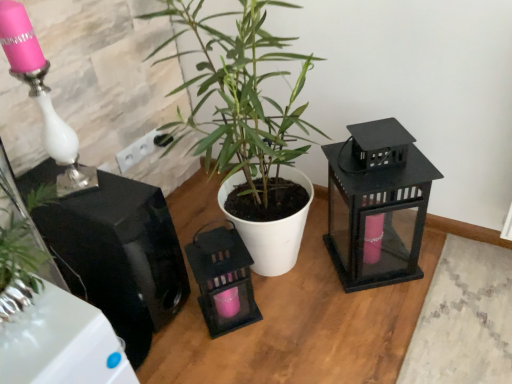
Identify the location of free space in front of green matte plant at center. (311, 337).